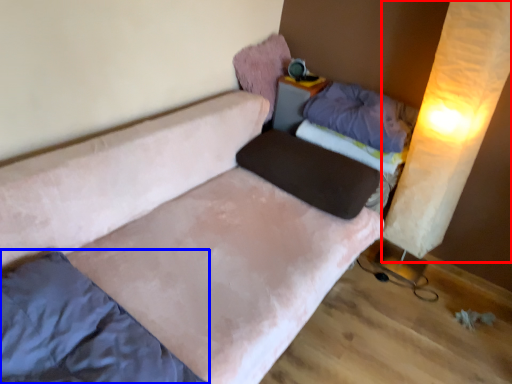
Question: Which object is closer to the camera taking this photo, curtain (highlighted by a red box) or mattress (highlighted by a blue box)?

Choices:
 (A) curtain
 (B) mattress

Answer: (B)